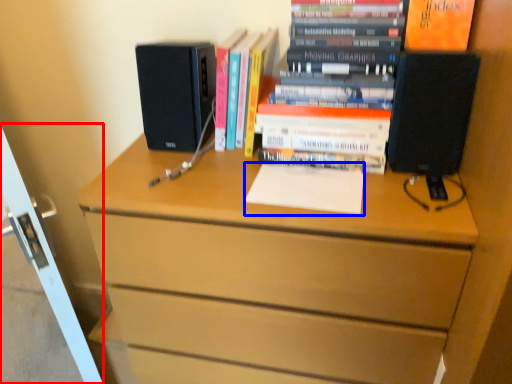
Question: Which of the following is the farthest to the observer, screen door (highlighted by a red box) or notepad (highlighted by a blue box)?

Choices:
 (A) screen door
 (B) notepad

Answer: (B)